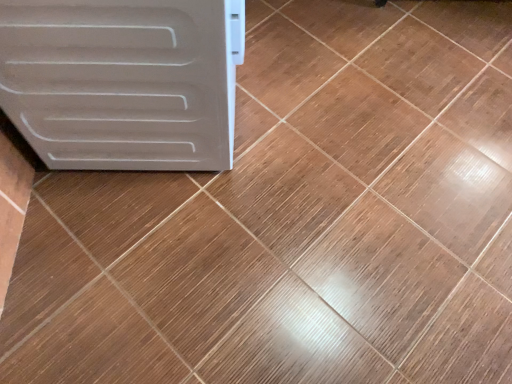
Measure the distance between matte plastic door at lower left and camera.

matte plastic door at lower left is 27.58 inches away from camera.

This screenshot has height=384, width=512. In order to click on matte plastic door at lower left in this screenshot , I will do tap(123, 81).

Describe the element at coordinates (123, 81) in the screenshot. I see `matte plastic door at lower left` at that location.

Where is `matte plastic door at lower left`? matte plastic door at lower left is located at coordinates (123, 81).